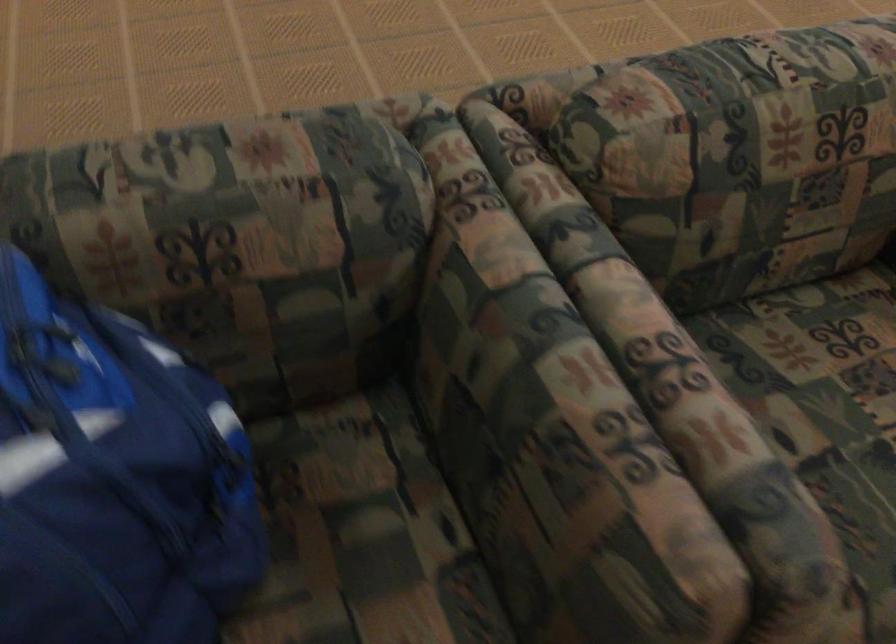
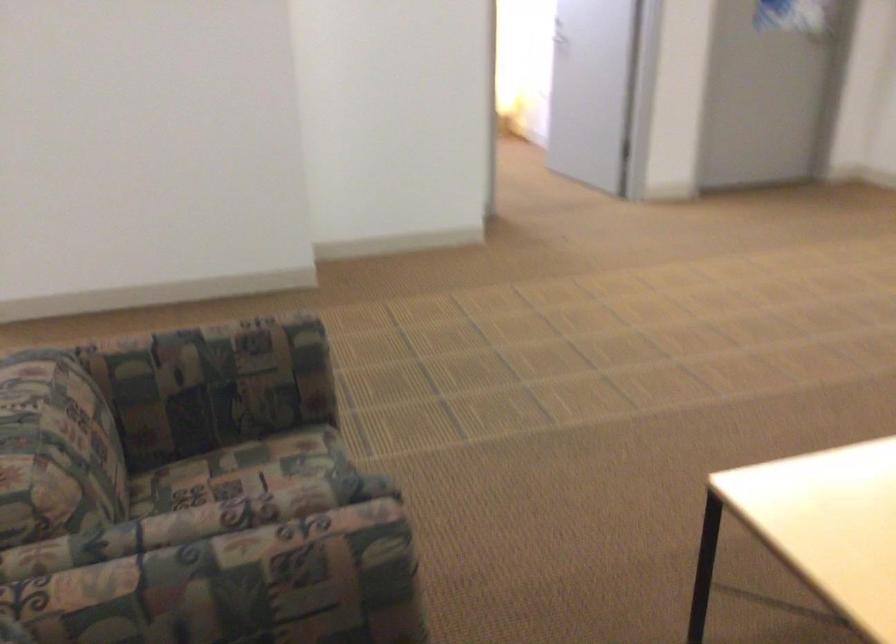
Question: Based on the continuous images, in which direction is the camera rotating? Reply with the corresponding letter.

Choices:
 (A) Left
 (B) Right
 (C) Up
 (D) Down

Answer: (B)